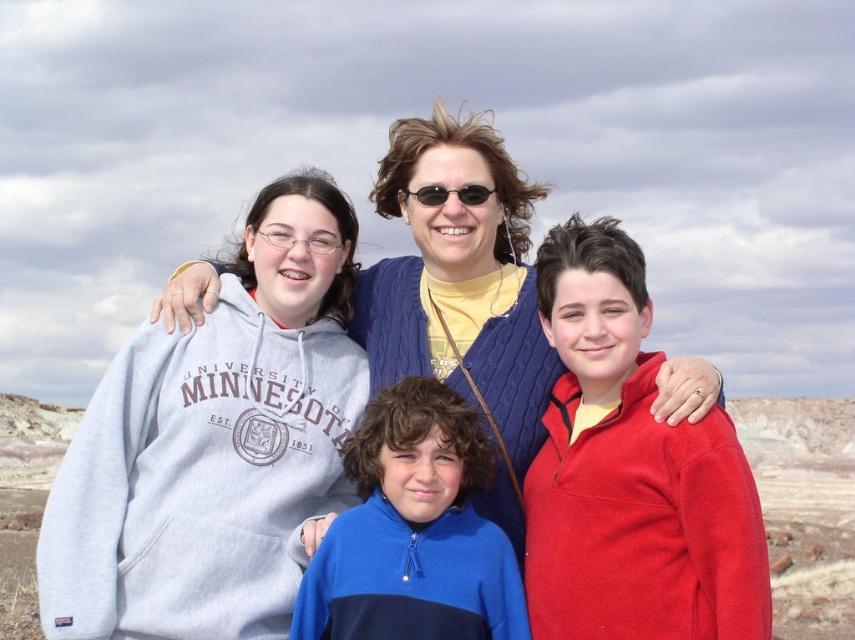
Question: Which point is closer to the camera taking this photo?

Choices:
 (A) (582, 384)
 (B) (373, 342)
 (C) (361, 481)

Answer: (C)

Question: Is matte red fleece jacket at right to the right of blue knit sweater at center from the viewer's perspective?

Choices:
 (A) no
 (B) yes

Answer: (B)

Question: Among these points, which one is farthest from the camera?

Choices:
 (A) (433, 468)
 (B) (488, 195)
 (C) (624, 557)

Answer: (B)

Question: Can you confirm if matte red fleece jacket at right is thinner than blue knit sweater at center?

Choices:
 (A) no
 (B) yes

Answer: (B)

Question: Which point is farther to the camera?

Choices:
 (A) (413, 580)
 (B) (127, 612)

Answer: (B)

Question: Is matte red fleece jacket at right wider than blue knit sweater at center?

Choices:
 (A) no
 (B) yes

Answer: (A)